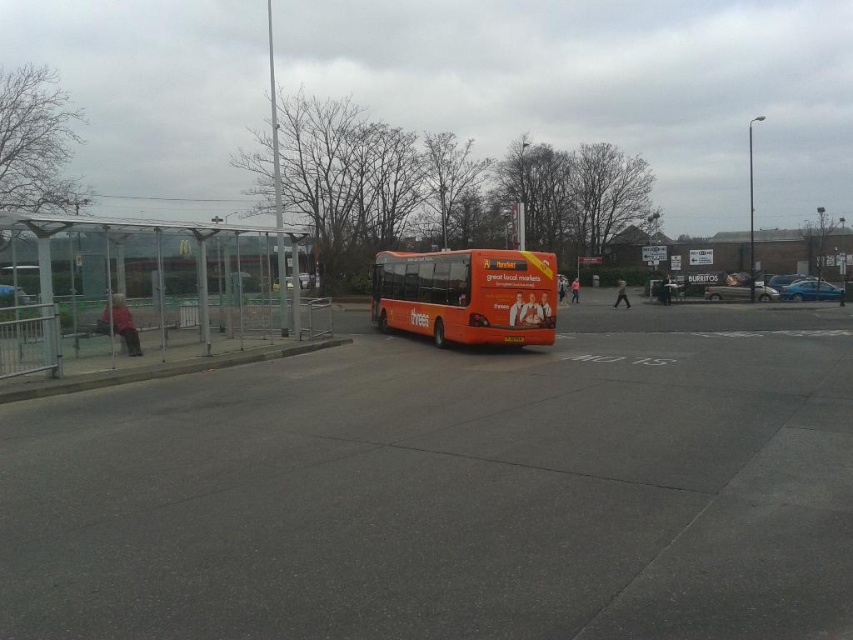
Question: Based on their relative distances, which object is farther from the orange matte/decorative bus at center?

Choices:
 (A) gray concrete curb at lower left
 (B) transparent glass bus stop at left

Answer: (B)

Question: Which is nearer to the orange matte/decorative bus at center?

Choices:
 (A) gray concrete curb at lower left
 (B) concrete pavement at center

Answer: (A)

Question: Does transparent glass bus stop at left have a lesser width compared to orange matte/decorative bus at center?

Choices:
 (A) yes
 (B) no

Answer: (A)

Question: Which of these objects is positioned farthest from the concrete pavement at center?

Choices:
 (A) gray concrete curb at lower left
 (B) orange matte/decorative bus at center
 (C) transparent glass bus stop at left

Answer: (A)

Question: Is concrete pavement at center closer to camera compared to gray concrete curb at lower left?

Choices:
 (A) no
 (B) yes

Answer: (B)

Question: Does transparent glass bus stop at left come in front of orange matte/decorative bus at center?

Choices:
 (A) no
 (B) yes

Answer: (B)